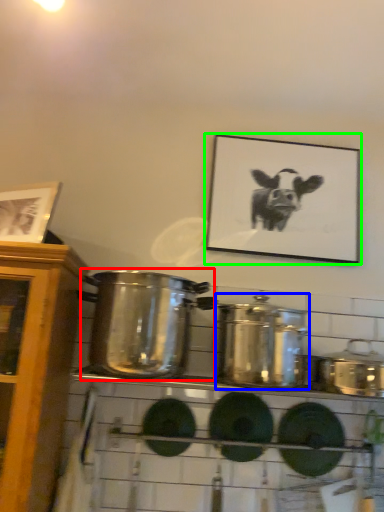
Question: Based on their relative distances, which object is nearer to crock pot (highlighted by a red box)? Choose from crock pot (highlighted by a blue box) and picture frame (highlighted by a green box).

Choices:
 (A) crock pot
 (B) picture frame

Answer: (A)